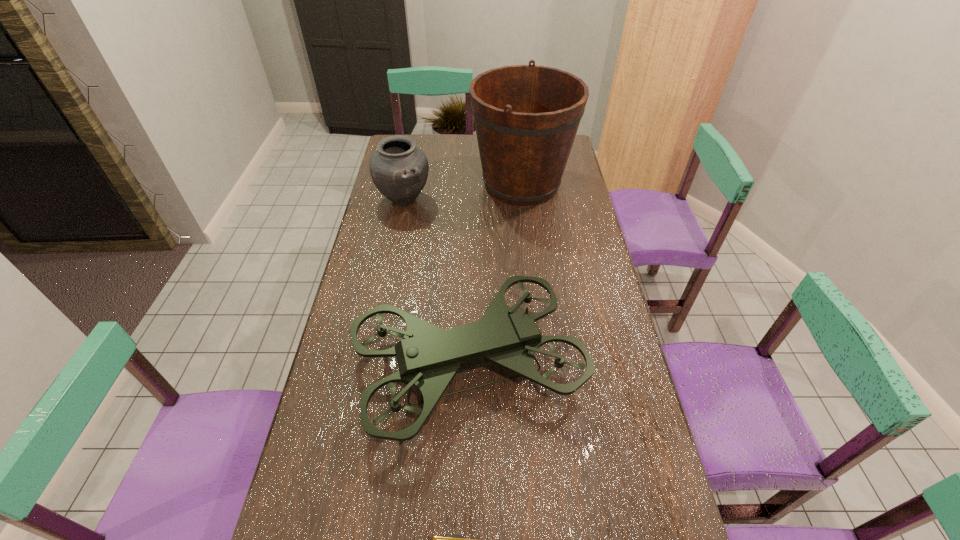
The width and height of the screenshot is (960, 540). What are the coordinates of `unoccupied position between the third farthest object and the bucket` in the screenshot? It's located at (495, 275).

Where is `vacant space in between the second nearest object and the tallest object`? This screenshot has height=540, width=960. vacant space in between the second nearest object and the tallest object is located at coordinates (495, 275).

Identify the location of the second closest object relative to the shortest object. This screenshot has height=540, width=960. (399, 169).

Locate which object ranks in proximity to the second nearest object. Please provide its 2D coordinates. Your answer should be formatted as a tuple, i.e. [(x, y)], where the tuple contains the x and y coordinates of a point satisfying the conditions above.

[(454, 539)]

In order to click on vacant area in the image that satisfies the following two spatial constraints: 1. on the back side of the bucket; 2. on the right side of the third shortest object in this screenshot , I will do `click(472, 184)`.

Where is `vacant space that satisfies the following two spatial constraints: 1. on the back side of the second shortest object; 2. on the right side of the tallest object`? This screenshot has width=960, height=540. vacant space that satisfies the following two spatial constraints: 1. on the back side of the second shortest object; 2. on the right side of the tallest object is located at coordinates (407, 184).